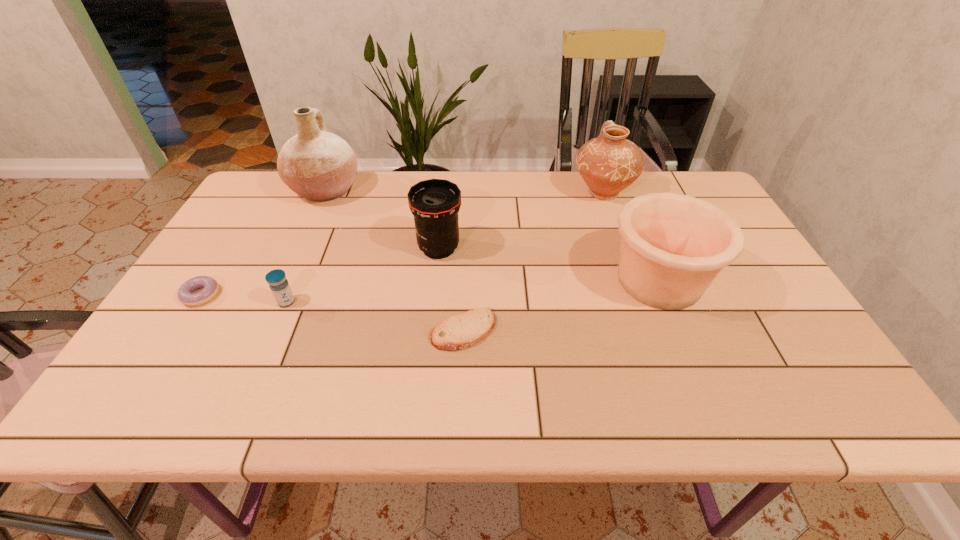
Where is `free space that satisfies the following two spatial constraints: 1. to pour from the handle of the nearest pottery; 2. on the right side of the tallest object`? The width and height of the screenshot is (960, 540). free space that satisfies the following two spatial constraints: 1. to pour from the handle of the nearest pottery; 2. on the right side of the tallest object is located at coordinates (283, 281).

In order to click on free space in the image that satisfies the following two spatial constraints: 1. to pour from the handle of the medicine; 2. on the right side of the tallest object in this screenshot , I will do `click(274, 302)`.